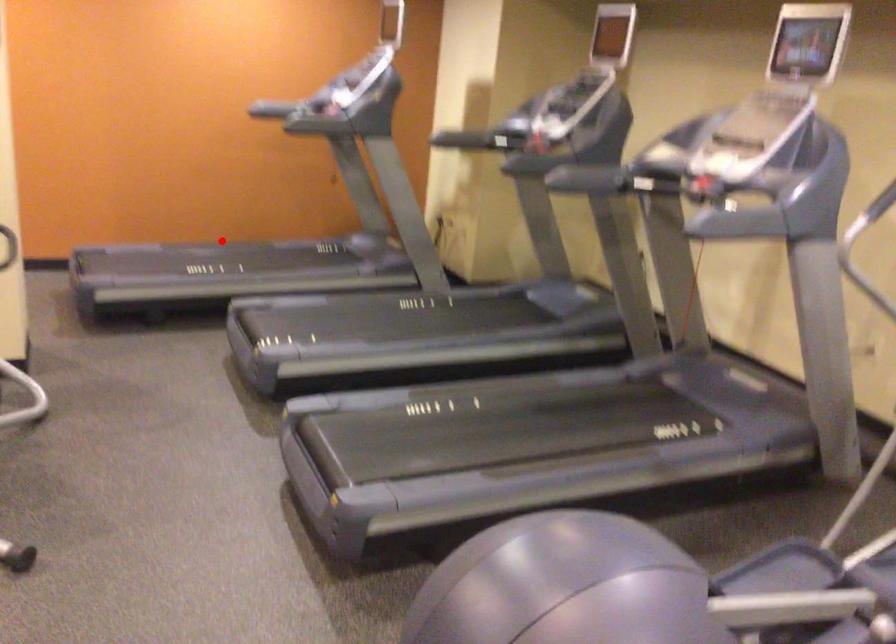
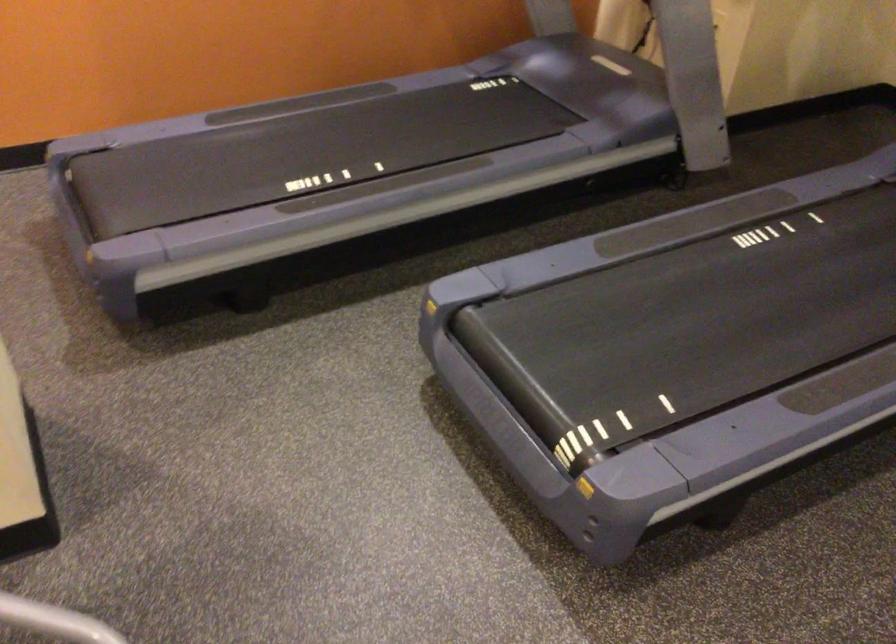
Question: I am providing you with two images of the same scene from different viewpoints. Given a red point in image1, look at the same physical point in image2. Is it:

Choices:
 (A) Closer to the viewpoint
 (B) Farther from the viewpoint

Answer: (A)